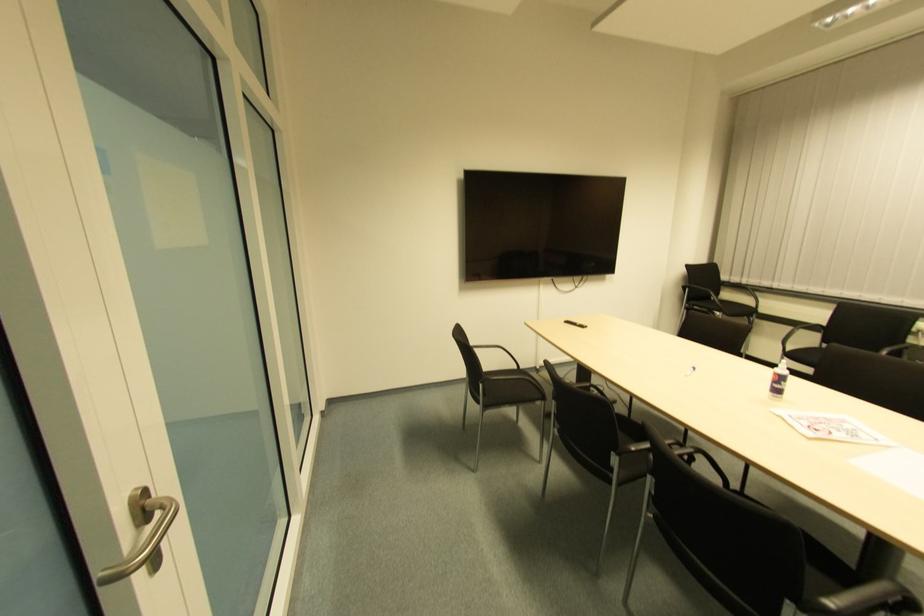
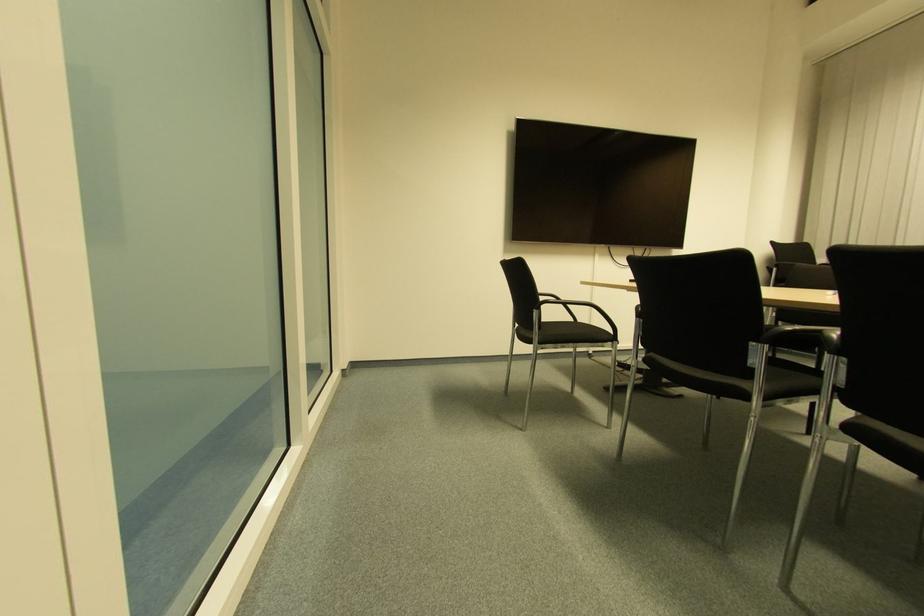
Question: Based on the continuous images, in which direction is the camera rotating? Reply with the corresponding letter.

Choices:
 (A) Left
 (B) Right
 (C) Up
 (D) Down

Answer: (C)